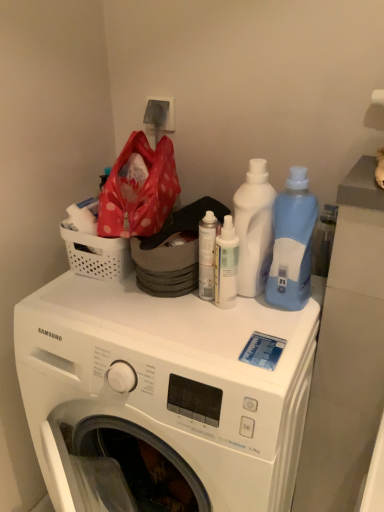
Image resolution: width=384 pixels, height=512 pixels. Find the location of `vacant space that is to the left of blue translucent bottle at right, acting as the 3th cleaning product starting from the left`. vacant space that is to the left of blue translucent bottle at right, acting as the 3th cleaning product starting from the left is located at coordinates (220, 317).